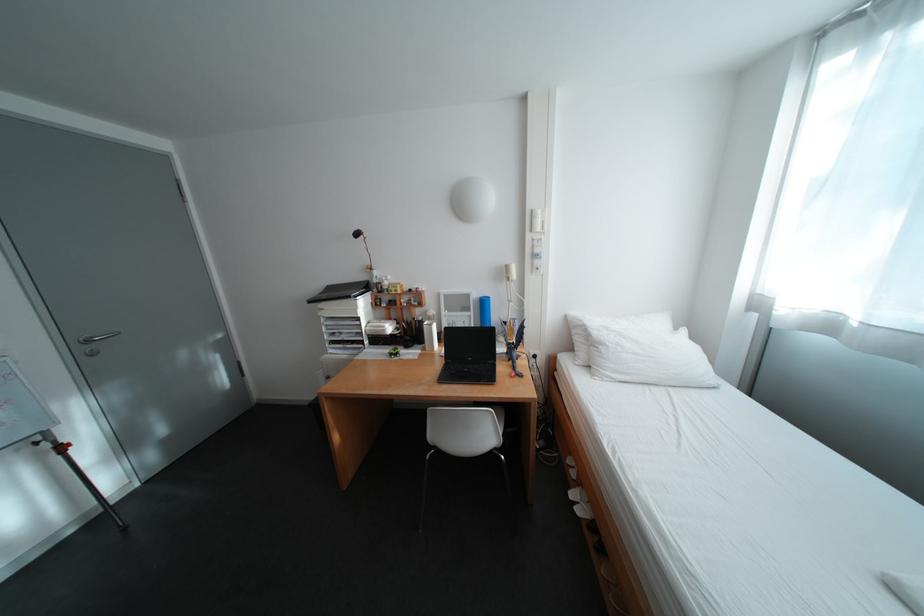
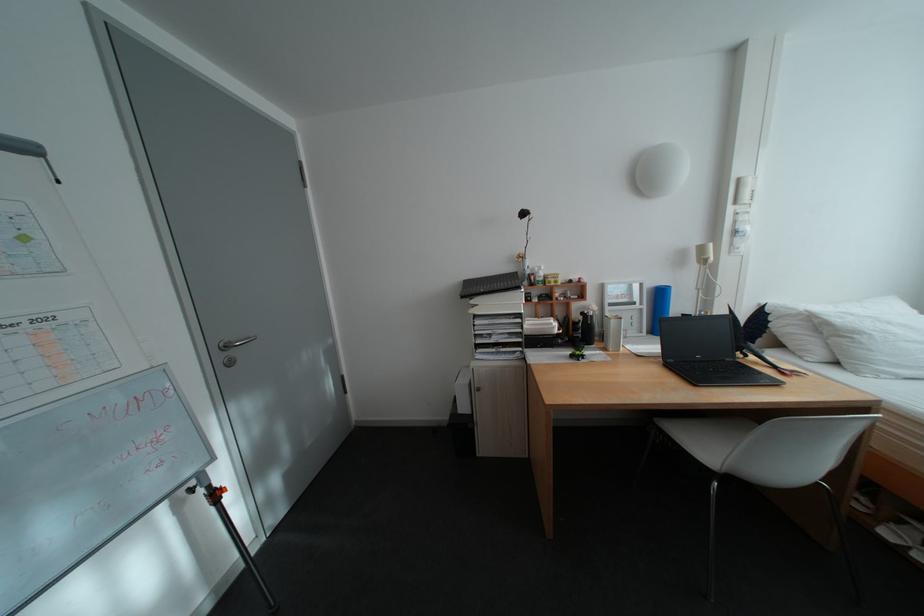
Locate, in the second image, the point that corresponds to point 49,445 in the first image.

(203, 492)